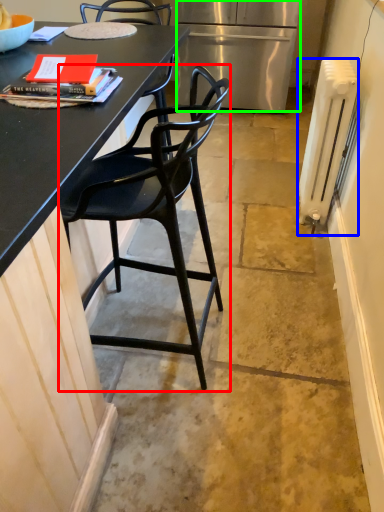
Question: Based on their relative distances, which object is nearer to chair (highlighted by a red box)? Choose from radiator (highlighted by a blue box) and refrigerator (highlighted by a green box).

Choices:
 (A) radiator
 (B) refrigerator

Answer: (A)